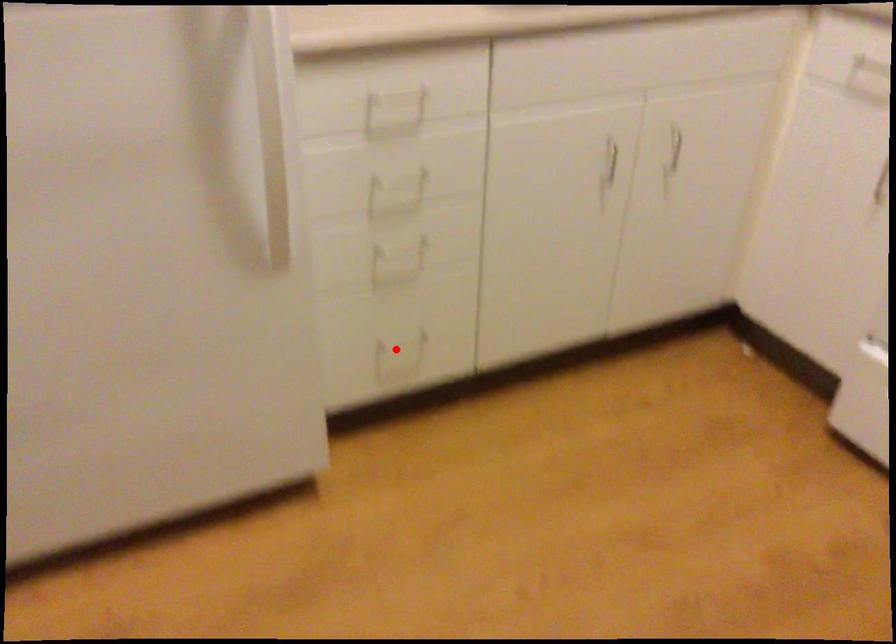
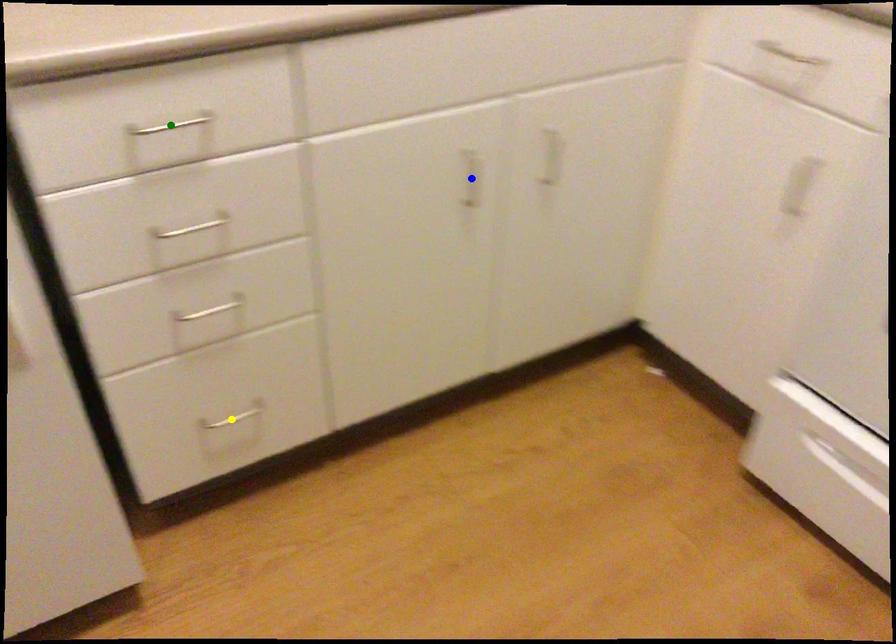
Question: I am providing you with two images of the same scene from different viewpoints. A red point is marked on the first image. You are given multiple points on the second image. Which spot in image 2 lines up with the point in image 1?

Choices:
 (A) green point
 (B) yellow point
 (C) blue point

Answer: (B)